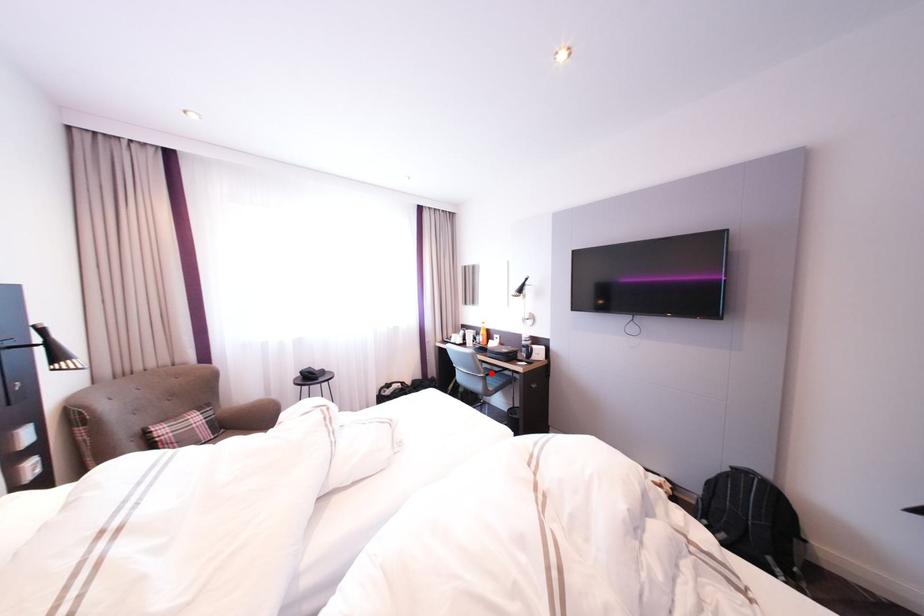
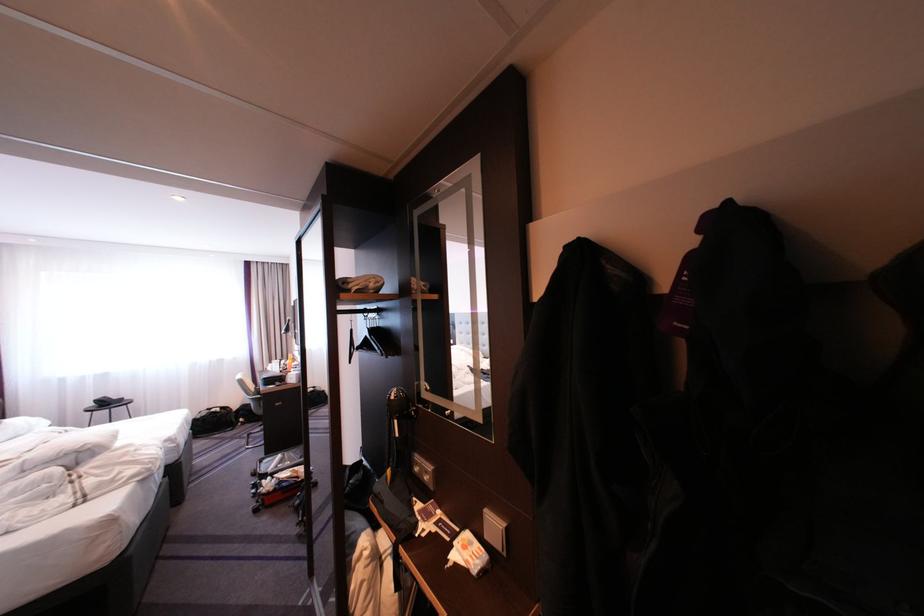
Find the pixel in the second image that matches the highlighted location in the first image.

(261, 395)